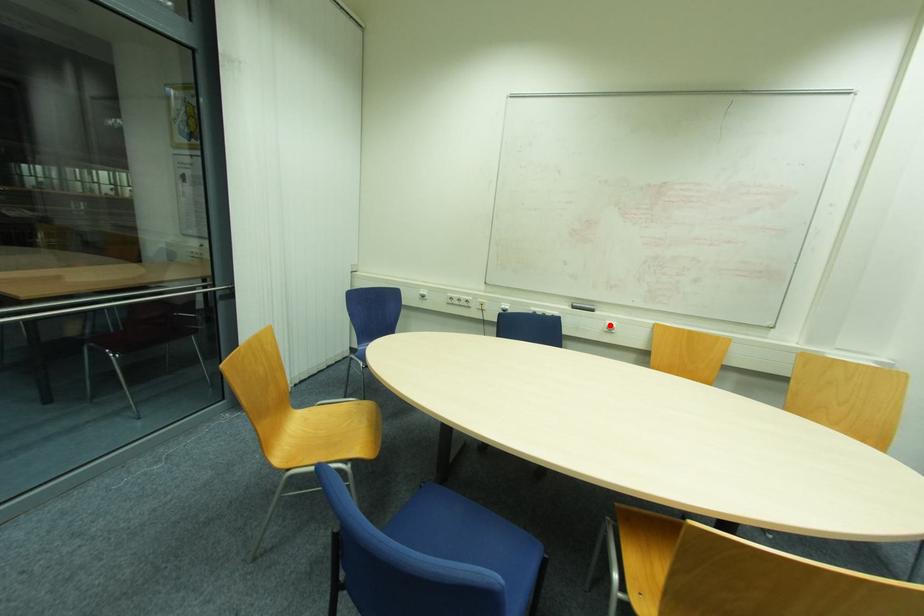
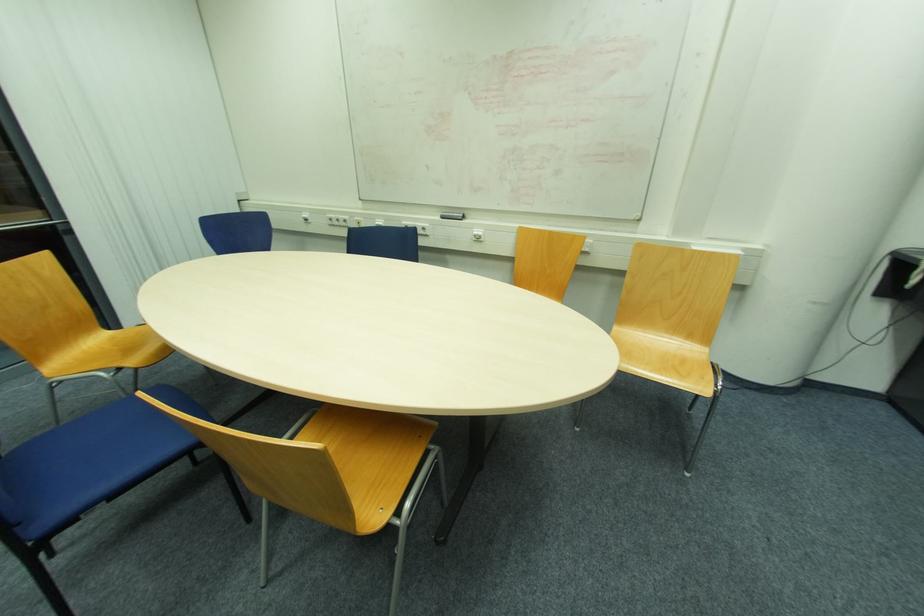
Question: I am providing you with two images of the same scene from different viewpoints. In image1, a red point is highlighted. Considering the same 3D point in image2, which of the following is correct?

Choices:
 (A) It is closer
 (B) It is farther

Answer: (A)